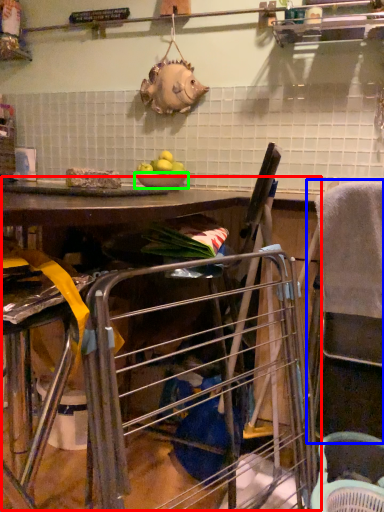
Question: Based on their relative distances, which object is nearer to workbench (highlighted by a red box)? Choose from feeding chair (highlighted by a blue box) and bowl (highlighted by a green box).

Choices:
 (A) feeding chair
 (B) bowl

Answer: (A)